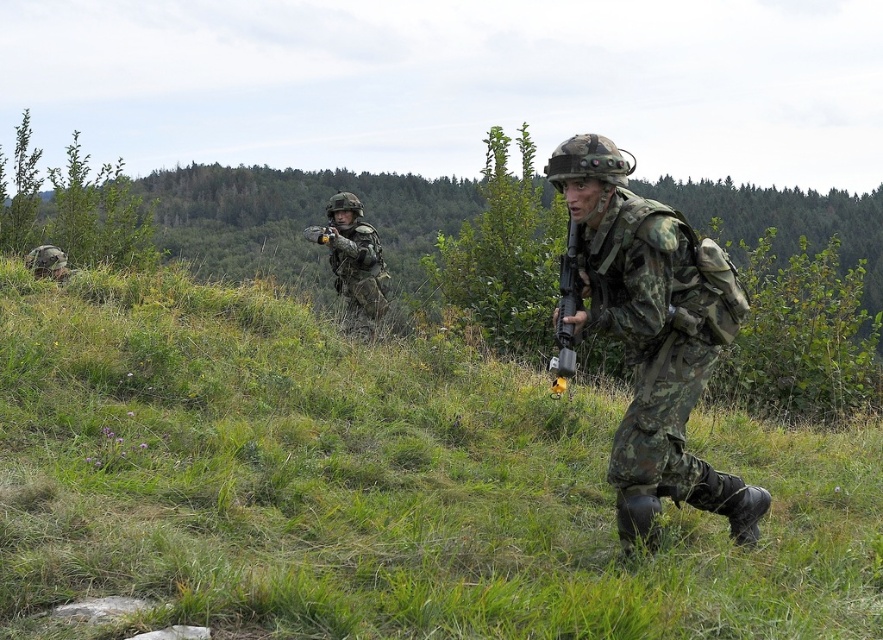
Question: Is green grassy at center positioned behind camouflage fabric helmet at center?

Choices:
 (A) yes
 (B) no

Answer: (B)

Question: Which point appears farthest from the camera in this image?

Choices:
 (A) (338, 221)
 (B) (470, 529)
 (C) (617, 467)
 (D) (561, 292)

Answer: (A)

Question: Does green grassy at center have a larger size compared to matte black rifle at center?

Choices:
 (A) yes
 (B) no

Answer: (A)

Question: Is green grassy at center below camouflage fabric uniform at center?

Choices:
 (A) yes
 (B) no

Answer: (A)

Question: Which point is farther to the camera?

Choices:
 (A) camouflage fabric helmet at center
 (B) matte black rifle at center
 (C) green grassy at center

Answer: (A)

Question: Among these objects, which one is nearest to the camera?

Choices:
 (A) camouflage fabric uniform at center
 (B) matte black rifle at center

Answer: (B)